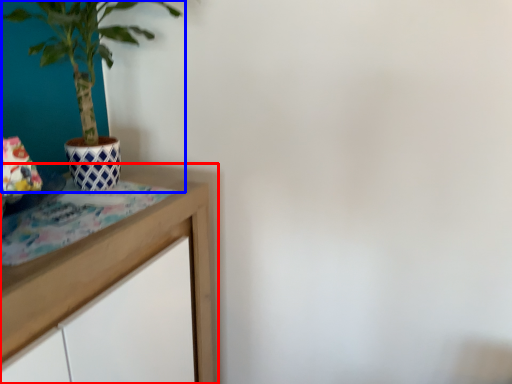
Question: Which of the following is the farthest to the observer, table (highlighted by a red box) or houseplant (highlighted by a blue box)?

Choices:
 (A) table
 (B) houseplant

Answer: (B)